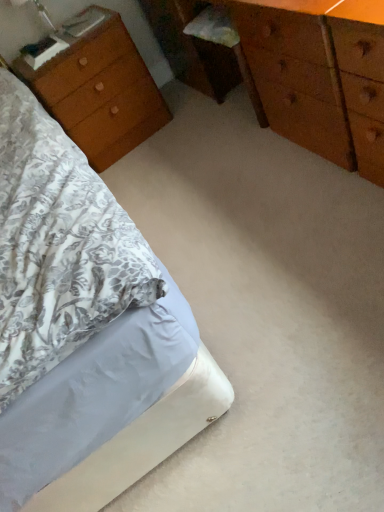
Question: Would you say wooden chest of drawers at center contains wooden nightstand at left?

Choices:
 (A) yes
 (B) no

Answer: (B)

Question: Is wooden chest of drawers at center facing away from wooden nightstand at left?

Choices:
 (A) yes
 (B) no

Answer: (B)

Question: Can you confirm if wooden chest of drawers at center is wider than wooden nightstand at left?

Choices:
 (A) yes
 (B) no

Answer: (B)

Question: Does wooden chest of drawers at center have a smaller size compared to wooden nightstand at left?

Choices:
 (A) yes
 (B) no

Answer: (B)

Question: Is wooden chest of drawers at center in front of wooden nightstand at left?

Choices:
 (A) yes
 (B) no

Answer: (A)

Question: Are wooden chest of drawers at center and wooden nightstand at left located far from each other?

Choices:
 (A) yes
 (B) no

Answer: (B)

Question: Is wooden nightstand at left thinner than wooden chest of drawers at center?

Choices:
 (A) no
 (B) yes

Answer: (A)

Question: Is wooden nightstand at left far away from wooden chest of drawers at center?

Choices:
 (A) no
 (B) yes

Answer: (A)

Question: From a real-world perspective, is wooden nightstand at left beneath wooden chest of drawers at center?

Choices:
 (A) no
 (B) yes

Answer: (B)

Question: Is the position of wooden nightstand at left less distant than that of wooden chest of drawers at center?

Choices:
 (A) no
 (B) yes

Answer: (A)

Question: Is wooden nightstand at left to the left of wooden chest of drawers at center from the viewer's perspective?

Choices:
 (A) no
 (B) yes

Answer: (B)

Question: Considering the relative positions of wooden nightstand at left and wooden chest of drawers at center in the image provided, is wooden nightstand at left to the right of wooden chest of drawers at center from the viewer's perspective?

Choices:
 (A) no
 (B) yes

Answer: (A)

Question: Is wooden chest of drawers at center at the left side of white fabric bed at lower left?

Choices:
 (A) no
 (B) yes

Answer: (A)